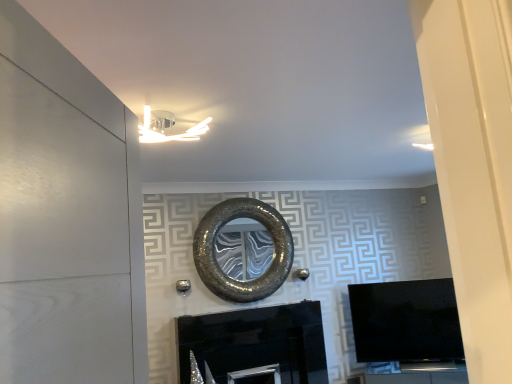
Question: Is black glossy fireplace at center placed right next to shiny metallic mirror at center?

Choices:
 (A) no
 (B) yes

Answer: (A)

Question: From the image's perspective, is black glossy fireplace at center located beneath shiny metallic mirror at center?

Choices:
 (A) no
 (B) yes

Answer: (B)

Question: Would you consider black glossy fireplace at center to be distant from shiny metallic mirror at center?

Choices:
 (A) yes
 (B) no

Answer: (B)

Question: From a real-world perspective, is black glossy fireplace at center located beneath shiny metallic mirror at center?

Choices:
 (A) no
 (B) yes

Answer: (B)

Question: Is black glossy fireplace at center positioned with its back to shiny metallic mirror at center?

Choices:
 (A) yes
 (B) no

Answer: (B)

Question: Does black glossy fireplace at center have a greater width compared to shiny metallic mirror at center?

Choices:
 (A) no
 (B) yes

Answer: (B)

Question: Is black glossy fireplace at center at the left side of white matte door at left?

Choices:
 (A) yes
 (B) no

Answer: (B)

Question: Does black glossy fireplace at center come behind white matte door at left?

Choices:
 (A) yes
 (B) no

Answer: (A)

Question: Does black glossy fireplace at center have a greater height compared to white matte door at left?

Choices:
 (A) yes
 (B) no

Answer: (B)

Question: From a real-world perspective, is black glossy fireplace at center under white matte door at left?

Choices:
 (A) no
 (B) yes

Answer: (B)

Question: Is black glossy fireplace at center facing away from white matte door at left?

Choices:
 (A) no
 (B) yes

Answer: (A)

Question: From the image's perspective, is black glossy fireplace at center beneath white matte door at left?

Choices:
 (A) yes
 (B) no

Answer: (A)

Question: Does shiny metallic mirror at center have a greater width compared to black glossy fireplace at center?

Choices:
 (A) no
 (B) yes

Answer: (A)